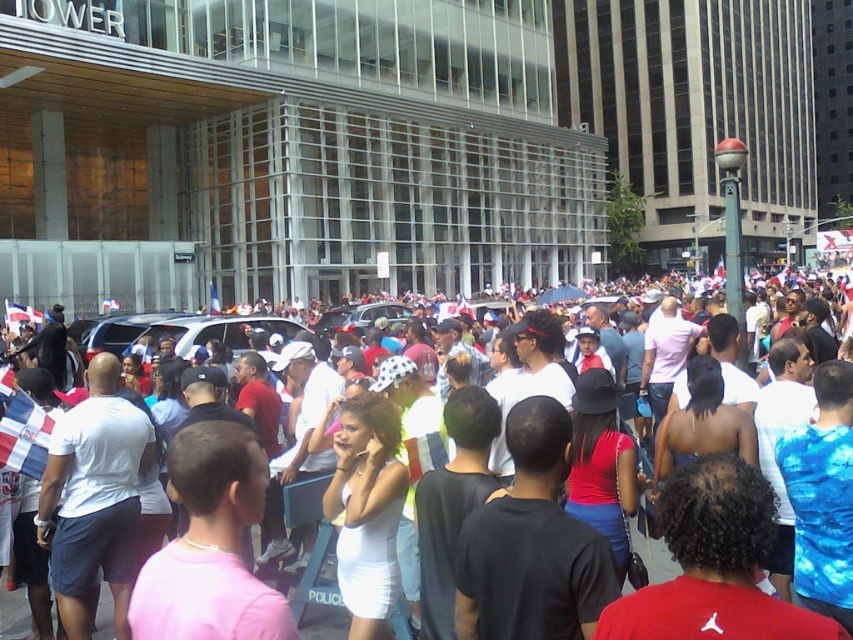
Question: Among these objects, which one is farthest from the camera?

Choices:
 (A) silver metallic suv at center
 (B) white cotton crowd at center

Answer: (A)

Question: Is white cotton crowd at center to the right of silver metallic suv at center from the viewer's perspective?

Choices:
 (A) no
 (B) yes

Answer: (B)

Question: Which of the following is the closest to the observer?

Choices:
 (A) white cotton crowd at center
 (B) silver metallic suv at center

Answer: (A)

Question: From the image, what is the correct spatial relationship of white cotton crowd at center in relation to silver metallic suv at center?

Choices:
 (A) above
 (B) below

Answer: (B)

Question: Can you confirm if white cotton crowd at center is smaller than silver metallic suv at center?

Choices:
 (A) no
 (B) yes

Answer: (A)